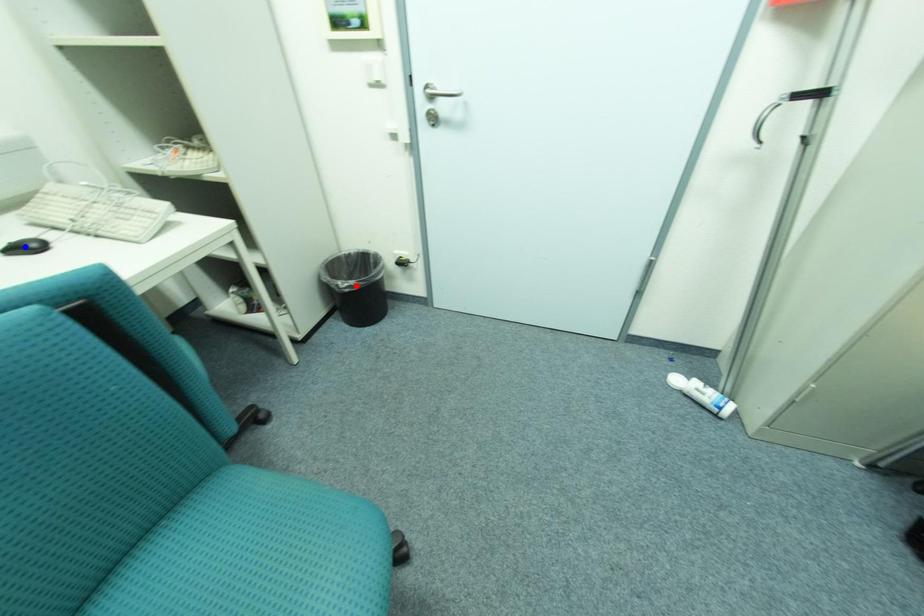
Question: In the image, two points are highlighted. Which point is nearer to the camera? Reply with the corresponding letter.

Choices:
 (A) blue point
 (B) red point

Answer: (A)